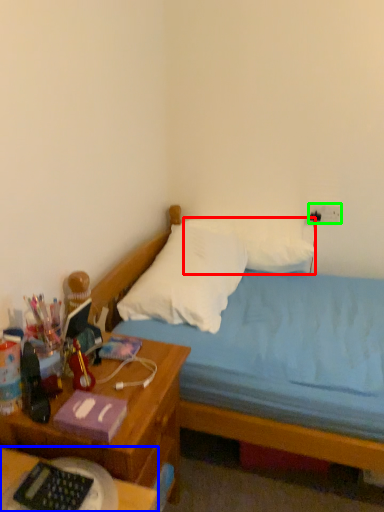
Question: Based on their relative distances, which object is nearer to pillow (highlighted by a red box)? Choose from desk (highlighted by a blue box) and electric outlet (highlighted by a green box).

Choices:
 (A) desk
 (B) electric outlet

Answer: (B)